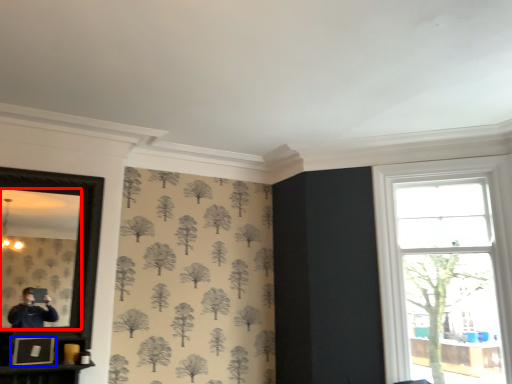
Question: Which object is further to the camera taking this photo, mirror (highlighted by a red box) or picture frame (highlighted by a blue box)?

Choices:
 (A) mirror
 (B) picture frame

Answer: (B)